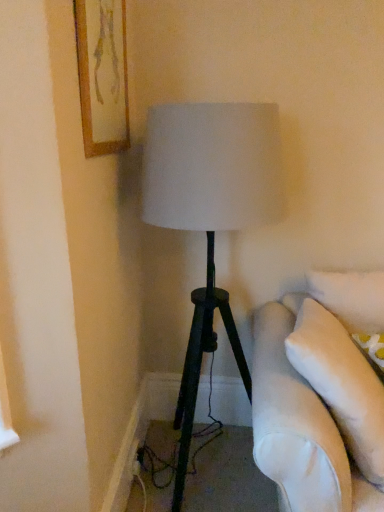
In order to click on black plastic outlet at lower left in this screenshot , I will do `click(136, 458)`.

The width and height of the screenshot is (384, 512). Describe the element at coordinates (136, 458) in the screenshot. I see `black plastic outlet at lower left` at that location.

What do you see at coordinates (102, 75) in the screenshot? I see `wooden framed artwork at upper left` at bounding box center [102, 75].

You are a GUI agent. You are given a task and a screenshot of the screen. Output one action in this format:
    pyautogui.click(x=<x>, y=<y>)
    Task: Click on the wooden framed artwork at upper left
    This screenshot has height=512, width=384.
    Given the screenshot: What is the action you would take?
    pyautogui.click(x=102, y=75)

In order to face wooden framed artwork at upper left, should I rotate leftwards or rightwards?

You should look left and rotate roughly 11.340 degrees.

Find the location of `black plastic outlet at lower left`. black plastic outlet at lower left is located at coordinates (136, 458).

Which object is positioned more to the right, black plastic outlet at lower left or wooden framed artwork at upper left?

black plastic outlet at lower left is more to the right.

Between black plastic outlet at lower left and wooden framed artwork at upper left, which one is positioned behind?

black plastic outlet at lower left is behind.

Does point (140, 469) come behind point (116, 17)?

Yes, it is behind point (116, 17).

From the image's perspective, relative to wooden framed artwork at upper left, is black plastic outlet at lower left above or below?

black plastic outlet at lower left is below wooden framed artwork at upper left.

From a real-world perspective, is black plastic outlet at lower left below wooden framed artwork at upper left?

Yes, from a real-world perspective, black plastic outlet at lower left is under wooden framed artwork at upper left.

Considering the relative sizes of black plastic outlet at lower left and wooden framed artwork at upper left in the image provided, is black plastic outlet at lower left wider than wooden framed artwork at upper left?

No, black plastic outlet at lower left is not wider than wooden framed artwork at upper left.

Between black plastic outlet at lower left and wooden framed artwork at upper left, which one has more height?

Standing taller between the two is wooden framed artwork at upper left.

Considering the relative sizes of black plastic outlet at lower left and wooden framed artwork at upper left in the image provided, is black plastic outlet at lower left smaller than wooden framed artwork at upper left?

Yes, black plastic outlet at lower left is smaller than wooden framed artwork at upper left.

Is wooden framed artwork at upper left inside black plastic outlet at lower left?

No, wooden framed artwork at upper left is not inside black plastic outlet at lower left.

Is black plastic outlet at lower left placed right next to wooden framed artwork at upper left?

black plastic outlet at lower left and wooden framed artwork at upper left are not in contact.

Is black plastic outlet at lower left oriented away from wooden framed artwork at upper left?

No, black plastic outlet at lower left is not facing the opposite direction of wooden framed artwork at upper left.

How many degrees apart are the facing directions of black plastic outlet at lower left and wooden framed artwork at upper left?

5.23 degrees.

Locate an element on the screen. The width and height of the screenshot is (384, 512). electric outlet behind the wooden framed artwork at upper left is located at coordinates (136, 458).

Is wooden framed artwork at upper left to the left of black plastic outlet at lower left from the viewer's perspective?

Yes.

Which object is more forward, wooden framed artwork at upper left or black plastic outlet at lower left?

wooden framed artwork at upper left is in front.

Between point (116, 10) and point (135, 463), which one is positioned behind?

The point (135, 463) is more distant.

From the image's perspective, is wooden framed artwork at upper left located above black plastic outlet at lower left?

Yes, from the image's perspective, wooden framed artwork at upper left is on top of black plastic outlet at lower left.

From a real-world perspective, is wooden framed artwork at upper left physically located above or below black plastic outlet at lower left?

wooden framed artwork at upper left is above black plastic outlet at lower left.

Which object is wider, wooden framed artwork at upper left or black plastic outlet at lower left?

Wider between the two is wooden framed artwork at upper left.

From their relative heights in the image, would you say wooden framed artwork at upper left is taller or shorter than black plastic outlet at lower left?

Clearly, wooden framed artwork at upper left is taller compared to black plastic outlet at lower left.

Considering the sizes of objects wooden framed artwork at upper left and black plastic outlet at lower left in the image provided, who is smaller, wooden framed artwork at upper left or black plastic outlet at lower left?

black plastic outlet at lower left.

From the picture: Could black plastic outlet at lower left be considered to be inside wooden framed artwork at upper left?

No, black plastic outlet at lower left is not inside wooden framed artwork at upper left.

Is the surface of wooden framed artwork at upper left in direct contact with black plastic outlet at lower left?

No, wooden framed artwork at upper left is not beside black plastic outlet at lower left.

Is wooden framed artwork at upper left turned away from black plastic outlet at lower left?

wooden framed artwork at upper left does not have its back to black plastic outlet at lower left.

Can you tell me how much wooden framed artwork at upper left and black plastic outlet at lower left differ in facing direction?

The angular difference between wooden framed artwork at upper left and black plastic outlet at lower left is 5.23 degrees.

Where is `electric outlet below the wooden framed artwork at upper left (from the image's perspective)`? The image size is (384, 512). electric outlet below the wooden framed artwork at upper left (from the image's perspective) is located at coordinates click(x=136, y=458).

You are a GUI agent. You are given a task and a screenshot of the screen. Output one action in this format:
    pyautogui.click(x=<x>, y=<y>)
    Task: Click on the electric outlet behind the wooden framed artwork at upper left
    
    Given the screenshot: What is the action you would take?
    pyautogui.click(x=136, y=458)

There is a black plastic outlet at lower left. Identify the location of picture frame above it (from a real-world perspective). The image size is (384, 512). (102, 75).